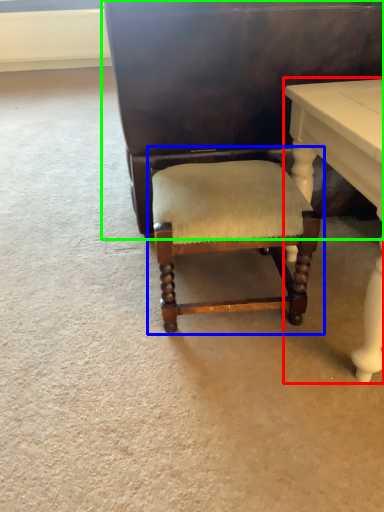
Question: Which is nearer to the table (highlighted by a red box)? chair (highlighted by a blue box) or vanity (highlighted by a green box).

Choices:
 (A) chair
 (B) vanity

Answer: (A)